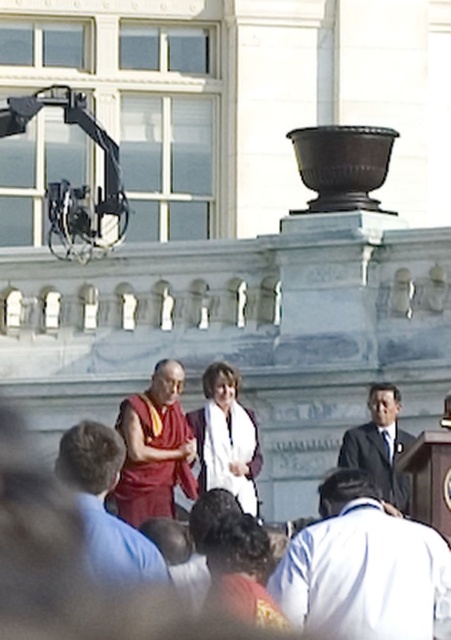
Question: Is white cotton shirt at lower center closer to the viewer compared to white cotton robe at center?

Choices:
 (A) no
 (B) yes

Answer: (B)

Question: Which point is closer to the camera?

Choices:
 (A) (312, 376)
 (B) (84, 476)

Answer: (B)

Question: Which of the following is the closest to the observer?

Choices:
 (A) (390, 605)
 (B) (78, 454)
 (C) (203, 420)

Answer: (A)

Question: From the image, what is the correct spatial relationship of white cotton robe at center in relation to dark suit at center?

Choices:
 (A) below
 (B) above

Answer: (A)

Question: Does white cotton shirt at center appear on the left side of white cotton shirt at lower center?

Choices:
 (A) no
 (B) yes

Answer: (B)

Question: Based on their relative distances, which object is farther from the white cotton robe at center?

Choices:
 (A) dark suit at center
 (B) white cotton shirt at center
 (C) maroon silk robe at center
 (D) matte red robe at center

Answer: (D)